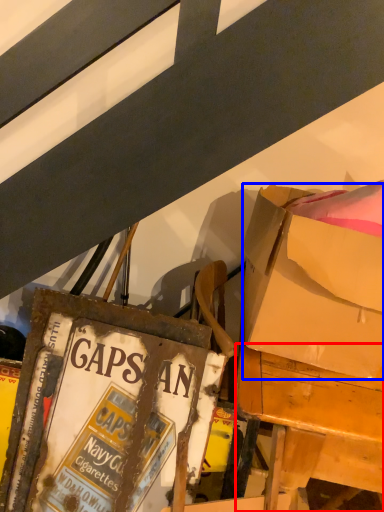
Question: Which point is closer to the camera, desk (highlighted by a red box) or box (highlighted by a blue box)?

Choices:
 (A) desk
 (B) box

Answer: (B)